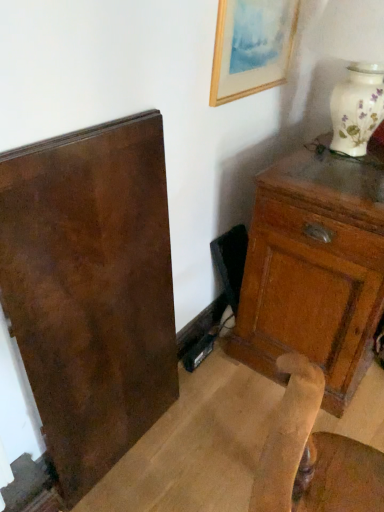
Question: Considering the positions of matte brown cabinet at right and wooden framed painting at upper right in the image, is matte brown cabinet at right bigger or smaller than wooden framed painting at upper right?

Choices:
 (A) big
 (B) small

Answer: (A)

Question: From the image's perspective, is matte brown cabinet at right above or below wooden framed painting at upper right?

Choices:
 (A) above
 (B) below

Answer: (B)

Question: Would you say matte brown cabinet at right is to the left or to the right of wooden framed painting at upper right in the picture?

Choices:
 (A) right
 (B) left

Answer: (A)

Question: Is wooden framed painting at upper right bigger or smaller than matte brown cabinet at right?

Choices:
 (A) big
 (B) small

Answer: (B)

Question: Is wooden framed painting at upper right inside or outside of matte brown cabinet at right?

Choices:
 (A) inside
 (B) outside

Answer: (B)

Question: Relative to matte brown cabinet at right, is wooden framed painting at upper right in front or behind?

Choices:
 (A) front
 (B) behind

Answer: (B)

Question: From the image's perspective, is wooden framed painting at upper right located above or below matte brown cabinet at right?

Choices:
 (A) above
 (B) below

Answer: (A)